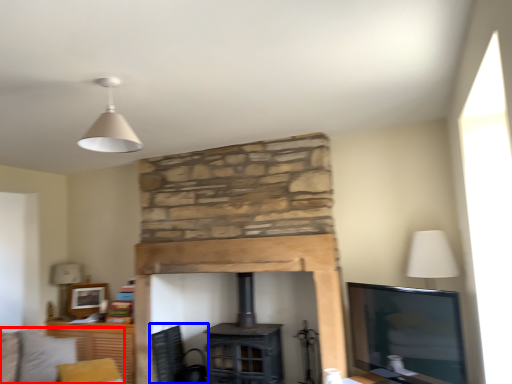
Question: Which of the following is the closest to the observer, couch (highlighted by a red box) or swivel chair (highlighted by a blue box)?

Choices:
 (A) couch
 (B) swivel chair

Answer: (A)